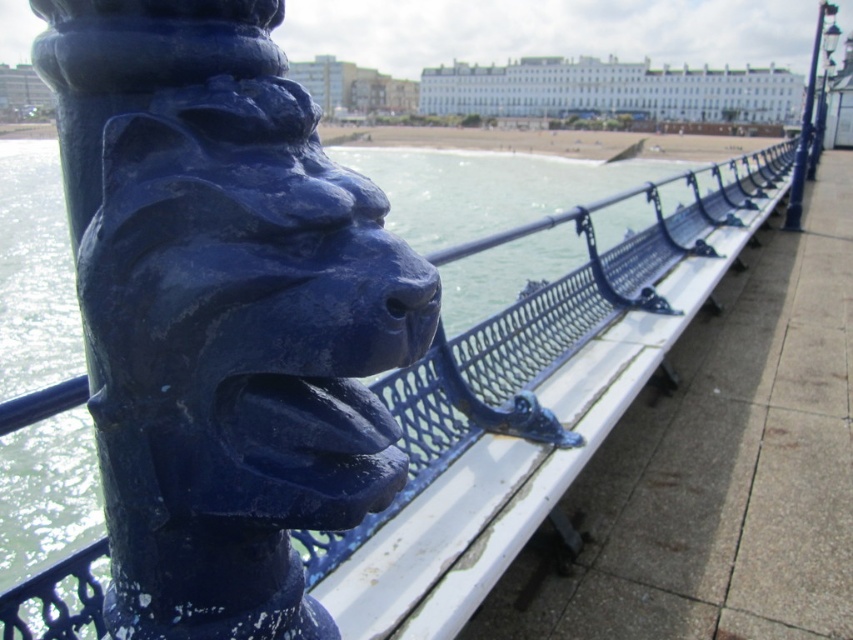
You are an artist sketching the scene from a distance. You want to ensure both the matte blue lion head at center and the smooth sand beach at center are visible in your drawing. Which object should you draw first to ensure it doesn

The matte blue lion head at center occupies less space than the smooth sand beach at center, so you should draw the smooth sand beach at center first to ensure it has enough space in the drawing.

You are standing on the promenade and want to walk towards the blue painted metal pole at upper right. Which direction should you move relative to the smooth sand beach at center?

To reach the blue painted metal pole at upper right from the smooth sand beach at center, you should move to the right since the blue painted metal pole at upper right is positioned on the right side of the smooth sand beach at center.